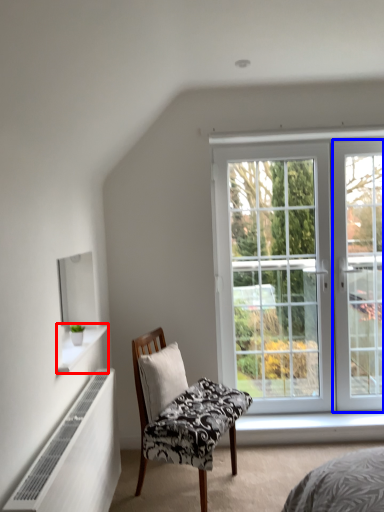
Question: Which object is closer to the camera taking this photo, window sill (highlighted by a red box) or screen door (highlighted by a blue box)?

Choices:
 (A) window sill
 (B) screen door

Answer: (A)